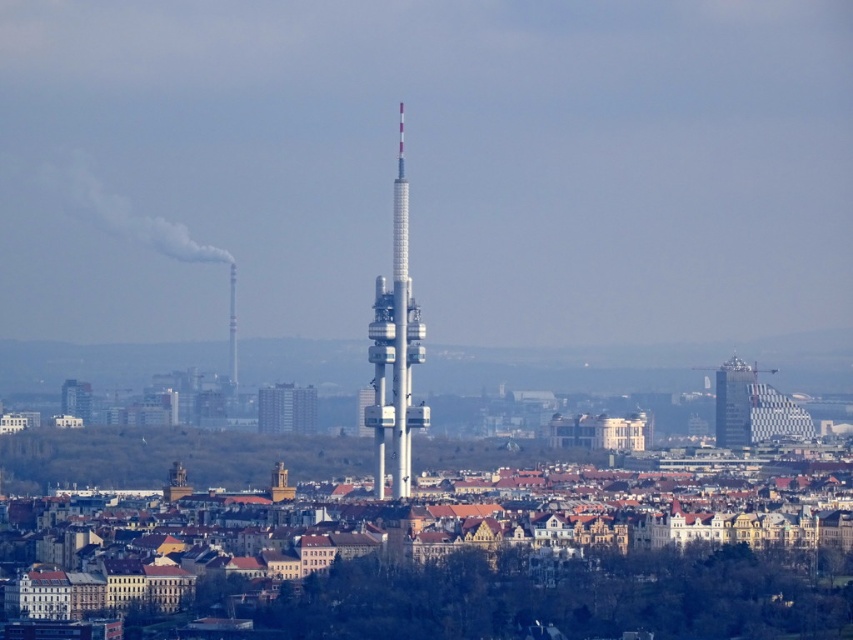
You are a city planner assessing the skyline. You need to determine if the white metallic tower at center could block the view of the glassy silver skyscraper at right from a vantage point directly in front of the tower. Based on their widths, what would you conclude?

The white metallic tower at center might be wider than glassy silver skyscraper at right, so it could potentially block the view of the glassy silver skyscraper at right depending on their exact widths and positioning.